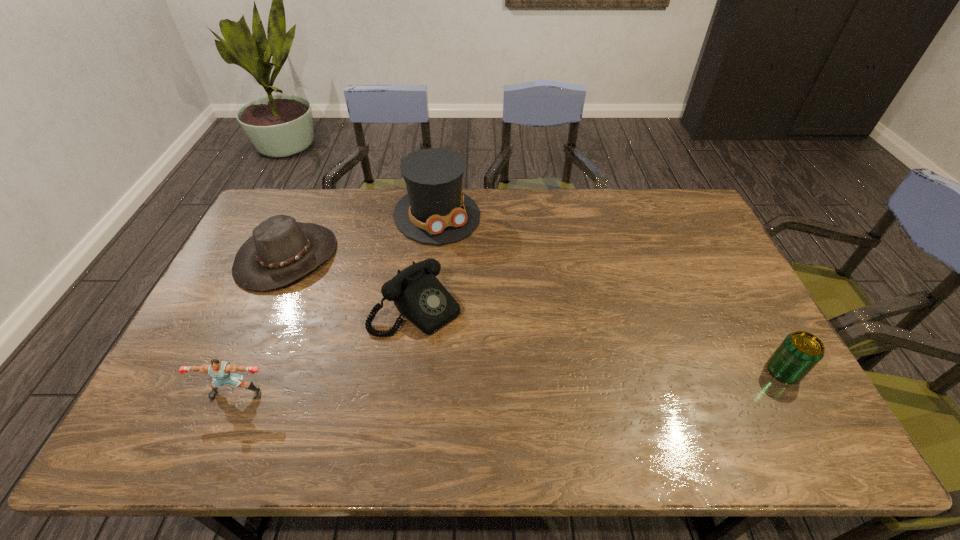
Find the location of `vacant space on the desktop that is between the puncher and the beer can and is positioned on the dial of the telephone`. vacant space on the desktop that is between the puncher and the beer can and is positioned on the dial of the telephone is located at coordinates (493, 383).

Find the location of `vacant space on the desktop that is between the puncher and the rightmost object and is positioned with goggles on the front of the tallest object`. vacant space on the desktop that is between the puncher and the rightmost object and is positioned with goggles on the front of the tallest object is located at coordinates (560, 380).

Locate an element on the screen. vacant space on the desktop that is between the puncher and the beer can and is positioned on the front-facing side of the hat is located at coordinates (491, 383).